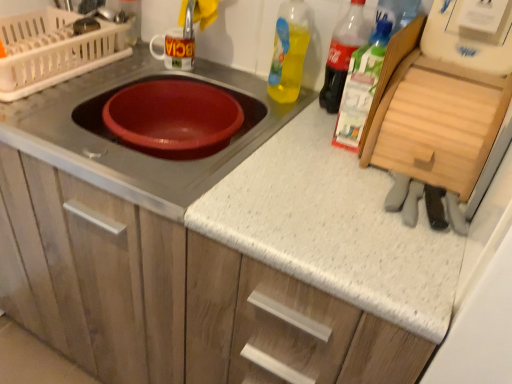
Question: Considering the positions of translucent plastic bottle at upper right, which is the first bottle from right to left, and matte white cabinet at center in the image, is translucent plastic bottle at upper right, which is the first bottle from right to left, wider or thinner than matte white cabinet at center?

Choices:
 (A) thin
 (B) wide

Answer: (A)

Question: From a real-world perspective, is translucent plastic bottle at upper right, which is the first bottle from right to left, above or below matte white cabinet at center?

Choices:
 (A) above
 (B) below

Answer: (A)

Question: Estimate the real-world distances between objects in this image. Which object is closer to the translucent plastic bottle at upper right, positioned as the second bottle in right-to-left order?

Choices:
 (A) translucent plastic bottle at upper right, placed as the third bottle when sorted from left to right
 (B) matte red bowl at center
 (C) translucent yellow liquid at upper right, the first bottle when ordered from left to right
 (D) matte plastic dish drainer at upper left
 (E) matte white cabinet at center

Answer: (A)

Question: Which object is the closest to the matte white cabinet at center?

Choices:
 (A) matte plastic dish drainer at upper left
 (B) translucent plastic bottle at upper right, arranged as the 2th bottle when viewed from the left
 (C) translucent plastic bottle at upper right, which is the first bottle from right to left
 (D) translucent yellow liquid at upper right, the third bottle when ordered from right to left
 (E) matte red bowl at center

Answer: (E)